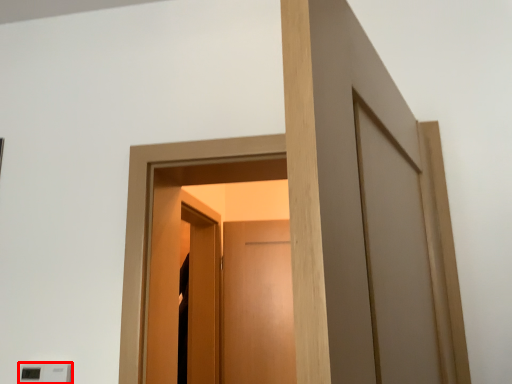
Question: From the image, what is the correct spatial relationship of light switch (annotated by the red box) in relation to screen door?

Choices:
 (A) right
 (B) left

Answer: (B)